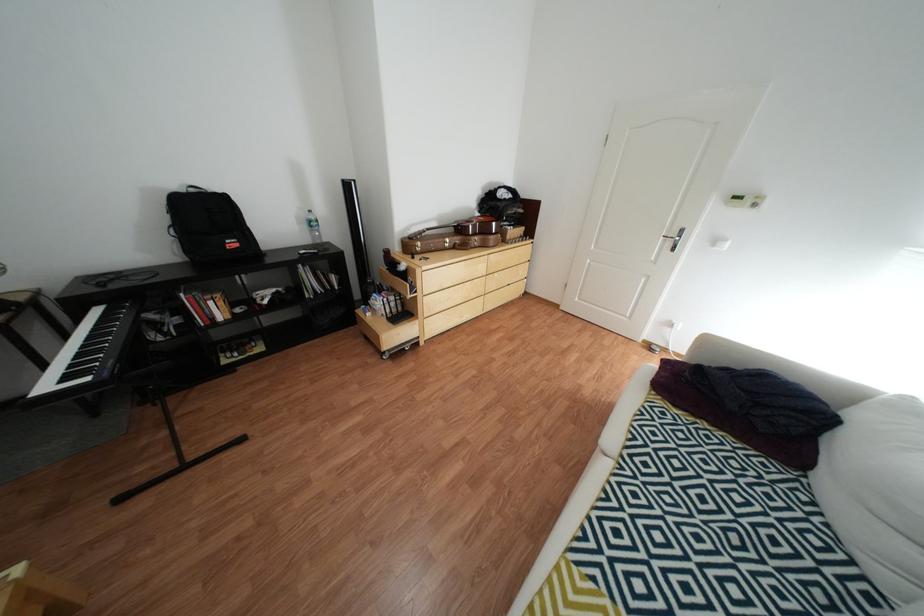
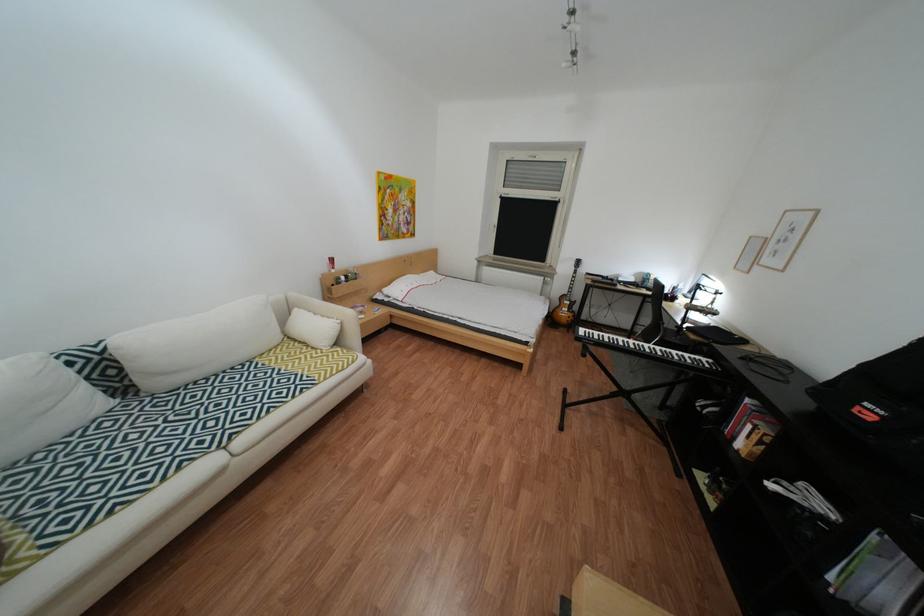
Where in the second image is the point corresponding to the point at 691,464 from the first image?

(176, 450)